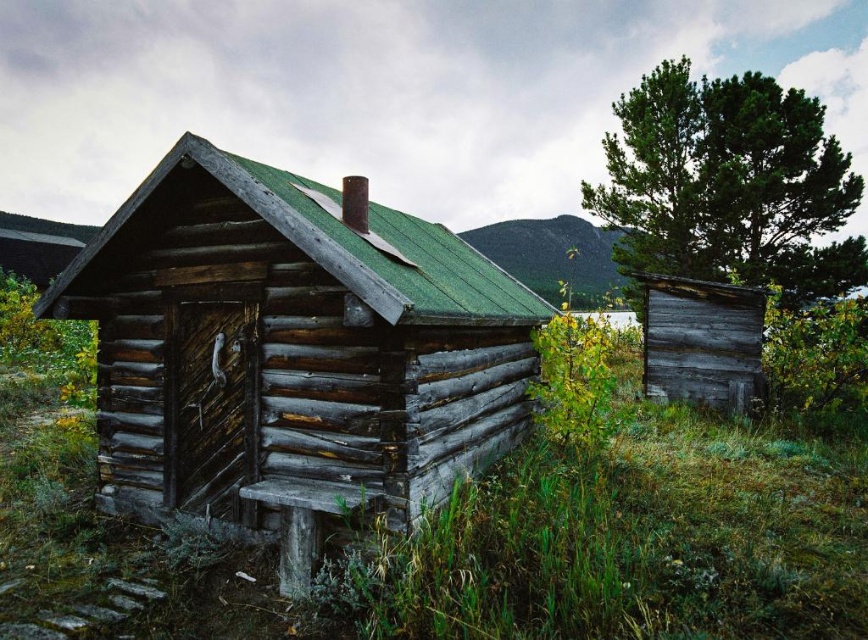
Does point (222, 490) lie behind point (656, 340)?

No, (222, 490) is closer to viewer.

Is weathered wood cabin at center thinner than weathered wood shed at right?

Yes.

At what (x,y) coordinates should I click in order to perform the action: click on weathered wood cabin at center. Please return your answer as a coordinate pair (x, y). The width and height of the screenshot is (868, 640). Looking at the image, I should click on (291, 349).

Is weathered wood cabin at center shorter than green textured tree at upper right?

Yes.

Can you confirm if weathered wood cabin at center is bigger than green textured tree at upper right?

Incorrect, weathered wood cabin at center is not larger than green textured tree at upper right.

Who is more distant from viewer, (261,417) or (740,115)?

The point (740,115) is behind.

You are a GUI agent. You are given a task and a screenshot of the screen. Output one action in this format:
    pyautogui.click(x=<x>, y=<y>)
    Task: Click on the weathered wood cabin at center
    
    Given the screenshot: What is the action you would take?
    pyautogui.click(x=291, y=349)

Does green textured tree at upper right lie behind weathered wood shed at right?

Yes, green textured tree at upper right is further from the viewer.

Does green textured tree at upper right appear under weathered wood shed at right?

Incorrect, green textured tree at upper right is not positioned below weathered wood shed at right.

Does point (709, 154) come farther from viewer compared to point (757, 349)?

Yes, it is behind point (757, 349).

At what (x,y) coordinates should I click in order to perform the action: click on green textured tree at upper right. Please return your answer as a coordinate pair (x, y). Looking at the image, I should click on [728, 184].